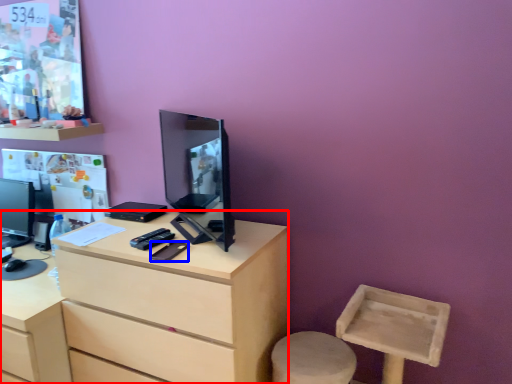
Question: Which of the following is the farthest to the observer, desk (highlighted by a red box) or mobile phone (highlighted by a blue box)?

Choices:
 (A) desk
 (B) mobile phone

Answer: (B)